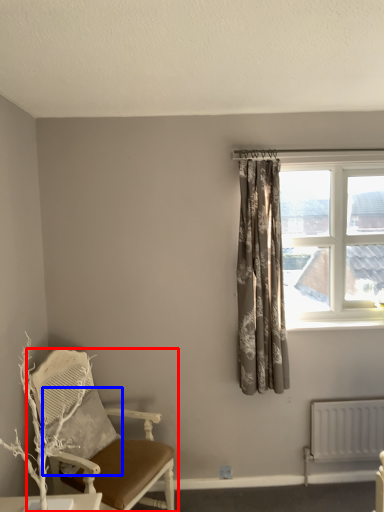
Question: Among these objects, which one is nearest to the camera, chair (highlighted by a red box) or pillow (highlighted by a blue box)?

Choices:
 (A) chair
 (B) pillow

Answer: (A)